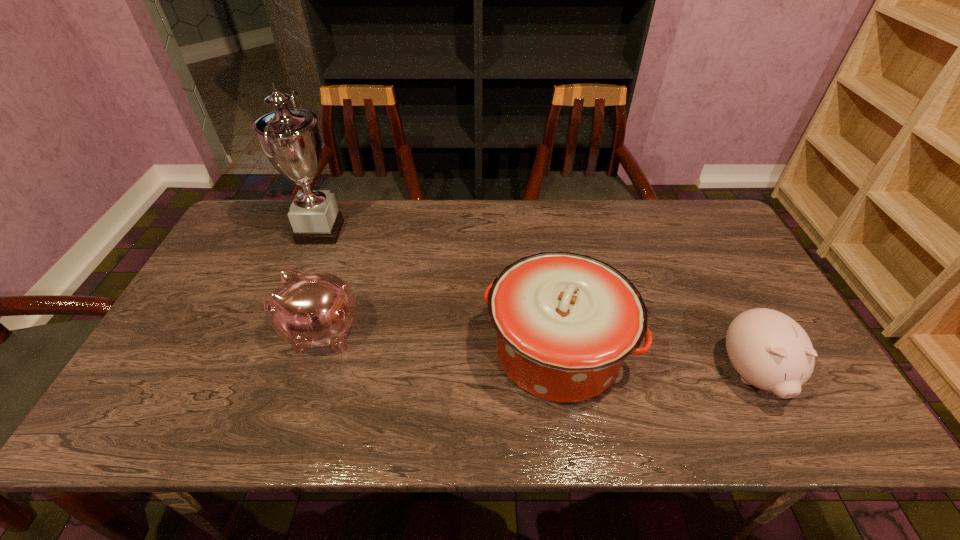
Find the location of a particular element. free space located 0.050m at the snout of the rightmost object is located at coordinates (784, 437).

Where is `object situated at the far edge`? This screenshot has width=960, height=540. object situated at the far edge is located at coordinates (290, 138).

In order to click on casserole that is at the near edge in this screenshot , I will do `click(565, 322)`.

Where is `piggy bank located in the near edge section of the desktop`? Image resolution: width=960 pixels, height=540 pixels. piggy bank located in the near edge section of the desktop is located at coordinates (770, 350).

Image resolution: width=960 pixels, height=540 pixels. I want to click on object at the right edge, so point(770,350).

At what (x,y) coordinates should I click in order to perform the action: click on object situated at the near right corner. Please return your answer as a coordinate pair (x, y). This screenshot has height=540, width=960. Looking at the image, I should click on (770, 350).

You are a GUI agent. You are given a task and a screenshot of the screen. Output one action in this format:
    pyautogui.click(x=<x>, y=<y>)
    Task: Click on the vacant region at the far edge of the desktop
    
    Given the screenshot: What is the action you would take?
    pyautogui.click(x=540, y=226)

I want to click on vacant space at the near edge of the desktop, so click(510, 414).

Where is `free space at the left edge of the desktop`? This screenshot has height=540, width=960. free space at the left edge of the desktop is located at coordinates (178, 383).

This screenshot has height=540, width=960. In order to click on vacant space at the right edge of the desktop in this screenshot , I will do `click(699, 265)`.